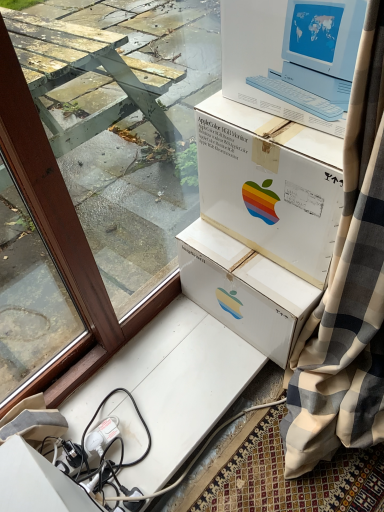
The width and height of the screenshot is (384, 512). I want to click on free spot above white cardboard box at upper center (from a real-world perspective), so click(x=276, y=117).